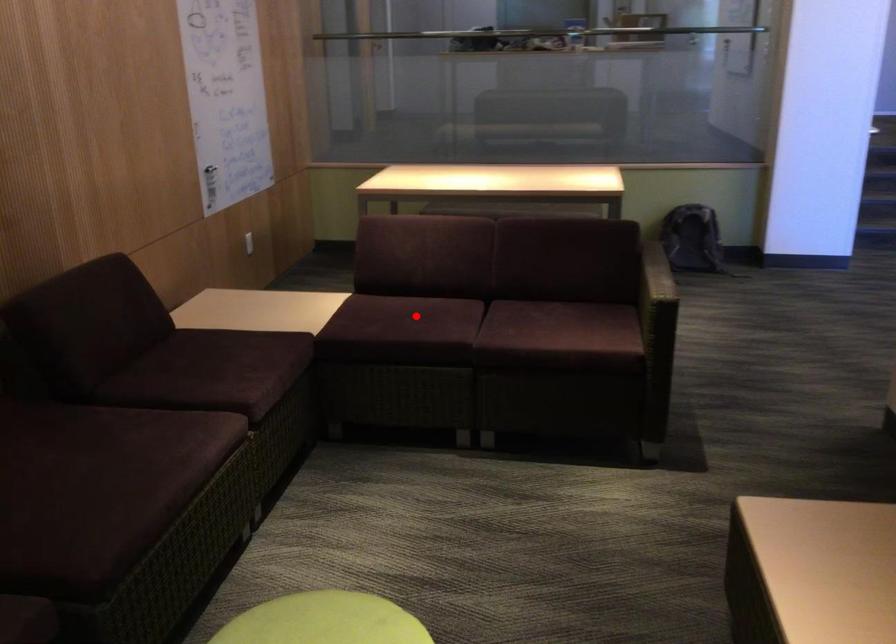
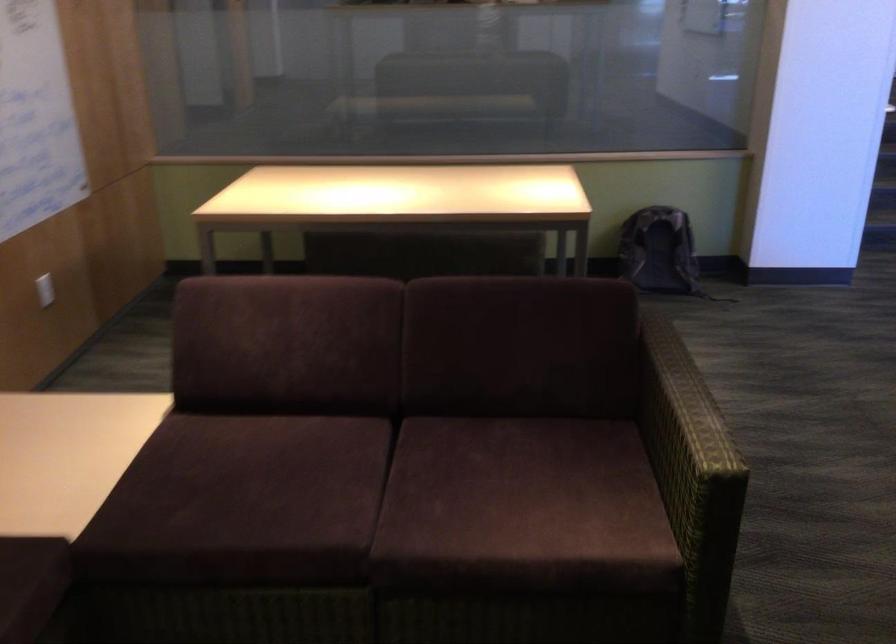
Question: A red point is marked in image1. In image2, is the corresponding 3D point closer to the camera or farther? Reply with the corresponding letter.

Choices:
 (A) The corresponding 3D point is closer.
 (B) The corresponding 3D point is farther.

Answer: (A)